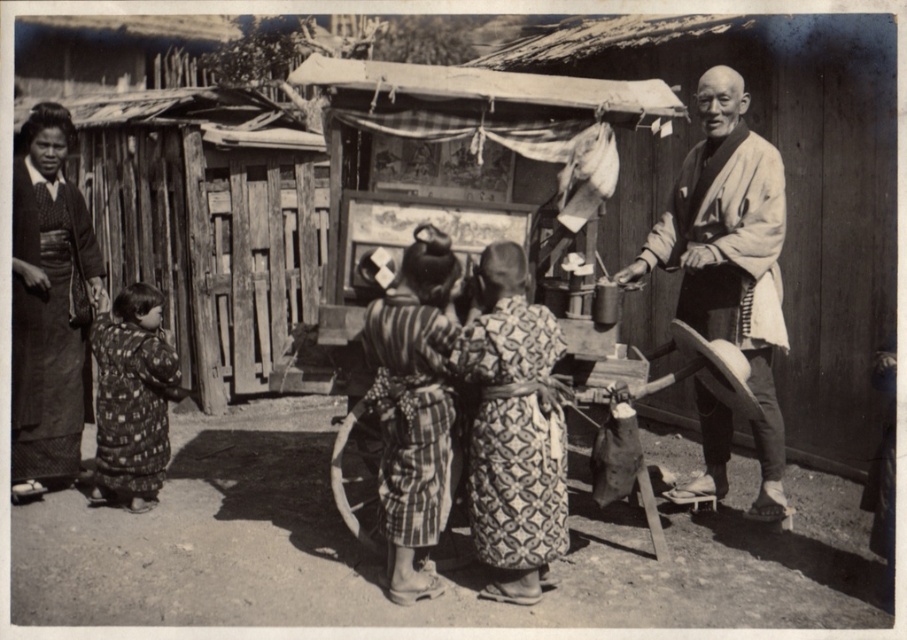
Question: Can you confirm if dark fabric kimono at left is bigger than printed fabric dress at left?

Choices:
 (A) no
 (B) yes

Answer: (B)

Question: From the image, what is the correct spatial relationship of white cotton kimono at right in relation to patterned fabric kimono at center?

Choices:
 (A) left
 (B) right

Answer: (B)

Question: Which of these objects is positioned closest to the white cotton kimono at right?

Choices:
 (A) printed fabric dress at left
 (B) patterned fabric kimono at center

Answer: (B)

Question: Is white cotton kimono at right above patterned fabric kimono at center?

Choices:
 (A) no
 (B) yes

Answer: (B)

Question: Which point appears closest to the camera in this image?

Choices:
 (A) (119, 492)
 (B) (714, 172)

Answer: (B)

Question: Which of the following is the farthest from the observer?

Choices:
 (A) striped fabric kimono at center
 (B) printed fabric dress at left
 (C) patterned fabric kimono at center
 (D) white cotton kimono at right

Answer: (B)